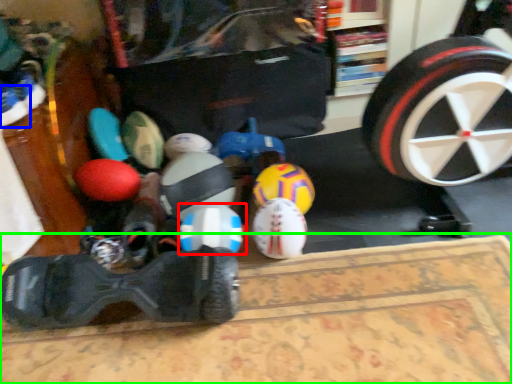
Question: Which object is the closest to the toy (highlighted by a red box)? Choose among these: footwear (highlighted by a blue box) or mat (highlighted by a green box).

Choices:
 (A) footwear
 (B) mat

Answer: (B)